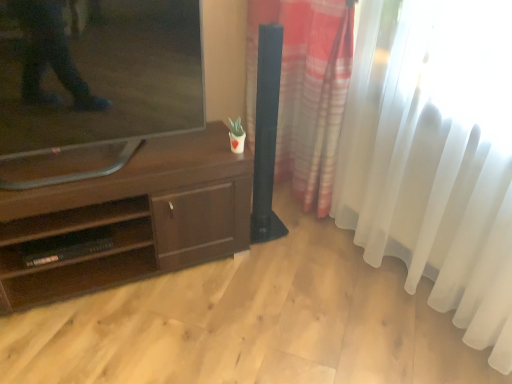
Where is `free space in front of dark brown wood tv stand at center`? This screenshot has height=384, width=512. free space in front of dark brown wood tv stand at center is located at coordinates (118, 335).